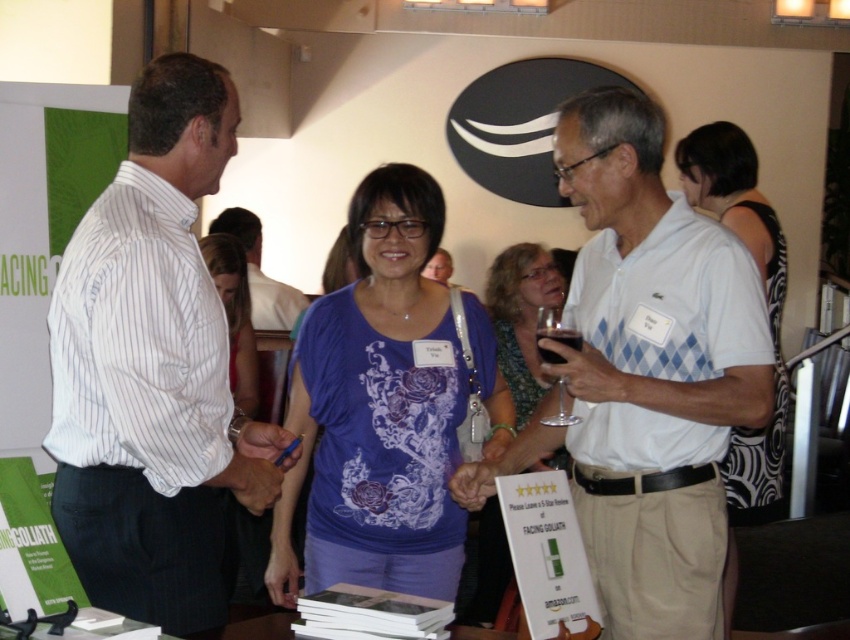
Can you confirm if purple printed shirt at center is taller than translucent glass at center?

Correct, purple printed shirt at center is much taller as translucent glass at center.

Is point (231, 301) farther from viewer compared to point (575, 342)?

Yes, it is behind point (575, 342).

Identify the location of purple printed shirt at center. (234, 316).

Between blue printed shirt at center and transparent glass at center, which one appears on the left side from the viewer's perspective?

Positioned to the left is transparent glass at center.

The image size is (850, 640). Describe the element at coordinates (520, 317) in the screenshot. I see `blue printed shirt at center` at that location.

Between point (484, 536) and point (570, 337), which one is positioned behind?

The point (484, 536) is more distant.

This screenshot has height=640, width=850. Identify the location of blue printed shirt at center. (520, 317).

Can you confirm if printed black dress at center is positioned to the right of purple printed shirt at center?

Yes, printed black dress at center is to the right of purple printed shirt at center.

Is point (746, 518) positioned before point (221, 257)?

Yes, it is.

Which is behind, point (760, 512) or point (231, 284)?

The point (231, 284) is more distant.

What are the coordinates of `printed black dress at center` in the screenshot? It's located at (765, 301).